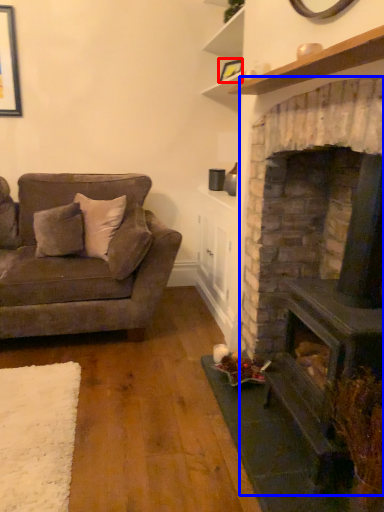
Question: Which object is further to the camera taking this photo, picture frame (highlighted by a red box) or fireplace (highlighted by a blue box)?

Choices:
 (A) picture frame
 (B) fireplace

Answer: (A)